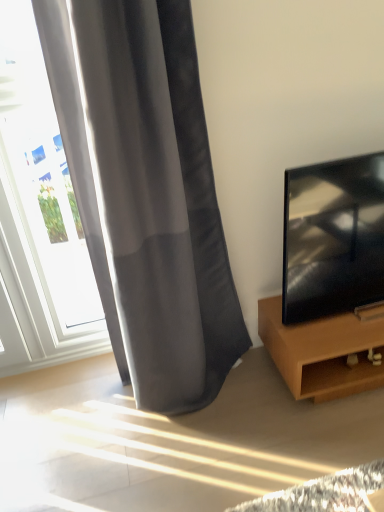
The height and width of the screenshot is (512, 384). I want to click on vacant space to the left of satin gray curtain at left, so click(x=80, y=418).